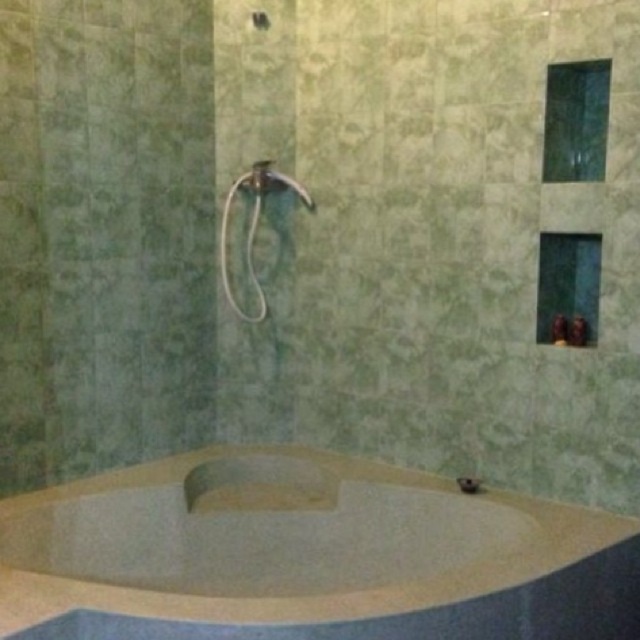
Looking at this image, you are standing in the bathroom and want to reach a point that is 8.38 feet away from you. Is the point at coordinates point (70, 497) within your reach?

The distance of point (70, 497) from camera is 8.38 feet, so the point is 8.38 feet away from you. Since the average human arm length is about 2.5 to 3 feet, you cannot reach the point at point (70, 497) as it is beyond your arm reach.

You are designing a bathroom layout and need to ensure that the beige stone jacuzzi at lower center and the matte white showerhead at upper center are spaced appropriately. Given that the showerhead must be at least 2 meters above the jacuzzi, is the current placement compliant with this requirement?

The beige stone jacuzzi at lower center is bigger than the matte white showerhead at upper center, but the description does not provide information about their vertical spacing. Therefore, we cannot determine if the showerhead is at least 2 meters above the jacuzzi based on the given details.